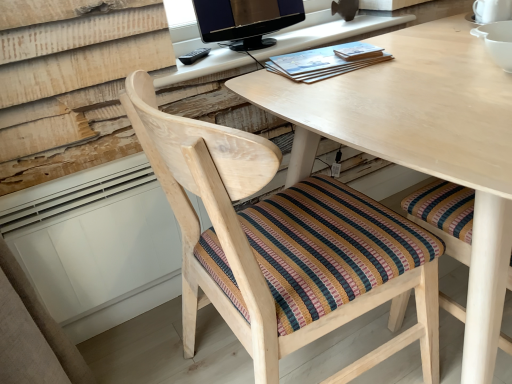
Where is `free space underneath matte black monitor at upper center (from a real-world perspective)`? The image size is (512, 384). free space underneath matte black monitor at upper center (from a real-world perspective) is located at coordinates (260, 41).